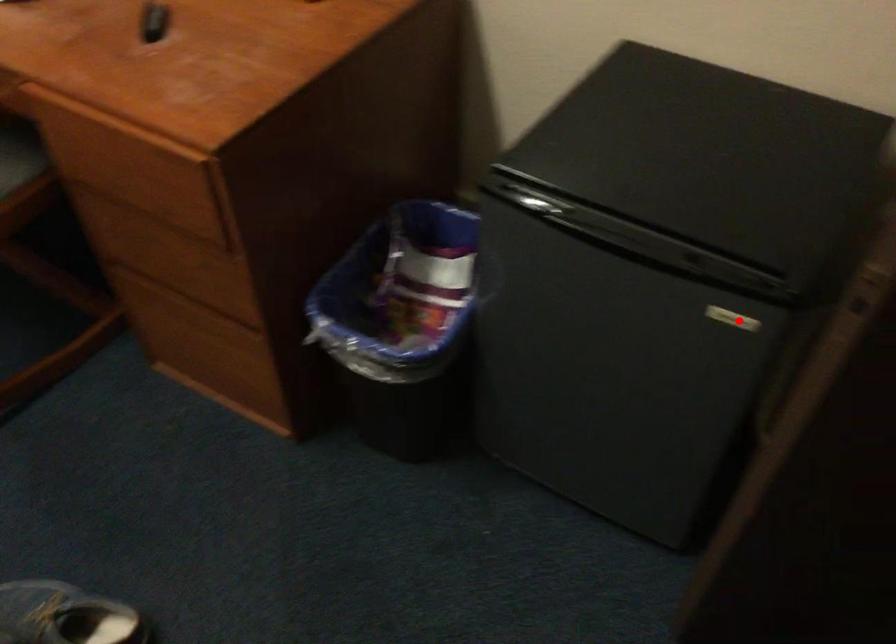
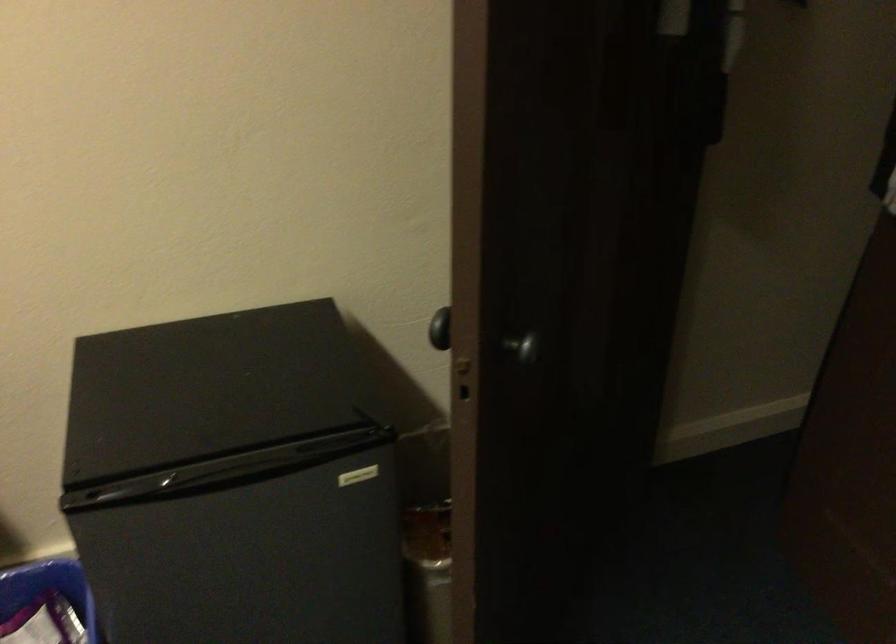
Question: A red point is marked in image1. In image2, is the corresponding 3D point closer to the camera or farther? Reply with the corresponding letter.

Choices:
 (A) The corresponding 3D point is closer.
 (B) The corresponding 3D point is farther.

Answer: (B)